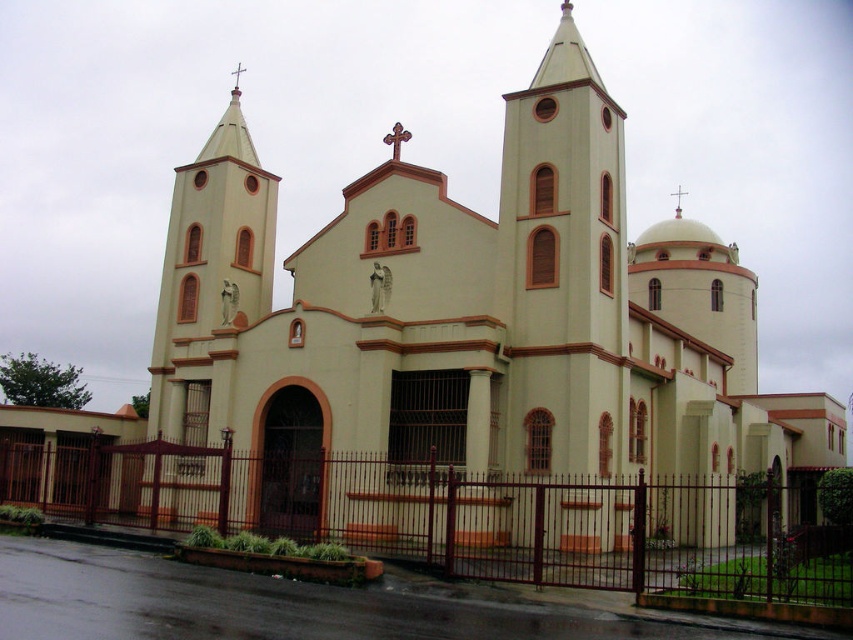
You are a photographer standing in front of the beige stucco church at center and the brown metal fence at lower center. You want to take a photo that captures the church without the fence in the foreground. What should you do?

The brown metal fence at lower center is behind the beige stucco church at center, so you can position yourself so that the beige stucco church at center is in front of the brown metal fence at lower center, thus blocking the fence from the foreground in your photo.

You are standing in front of the church and notice two points marked on the facade. The first point is at coordinates point (509, 492) and the second is at point (387, 138). Which of these points is closer to you as you face the church?

Point (509, 492) is in front of point (387, 138), so it is closer to you as you face the church.

You are standing in front of the church and want to know if the beige stucco church at center is wider than the brown metal fence at lower center. Can you confirm this?

The beige stucco church at center is wider than the brown metal fence at lower center, so yes, the beige stucco church at center is wider than the brown metal fence at lower center.